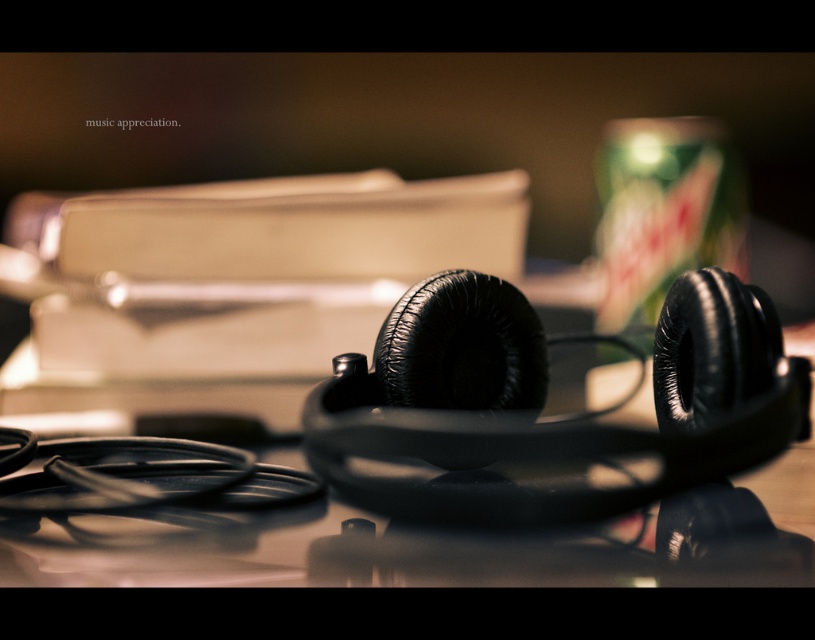
Is black matte headphones at center to the right of green matte can at upper right from the viewer's perspective?

Incorrect, black matte headphones at center is not on the right side of green matte can at upper right.

Does point (349, 563) come farther from viewer compared to point (689, 163)?

No, (349, 563) is closer to viewer.

This screenshot has height=640, width=815. I want to click on black matte headphones at center, so click(x=421, y=547).